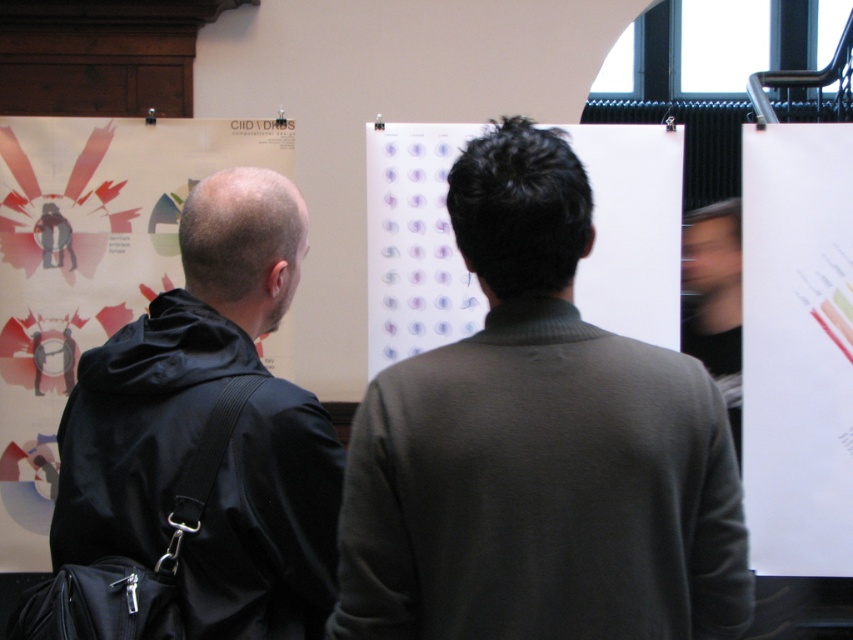
Which is in front, point (325, 566) or point (798, 540)?

Point (325, 566)

Identify the location of black matte jacket at left. The image size is (853, 640). (204, 426).

Is white paper at right thinner than white paper at center?

Yes.

Is white paper at right shorter than white paper at center?

No.

Find the location of a particular element. This screenshot has width=853, height=640. white paper at right is located at coordinates (798, 348).

This screenshot has width=853, height=640. In order to click on white paper at right in this screenshot , I will do `click(798, 348)`.

Is point (485, 529) farther from camera compared to point (260, 234)?

No, (485, 529) is in front of (260, 234).

Measure the distance from dark green sweater at center to black matte jacket at left.

The distance of dark green sweater at center from black matte jacket at left is 14.08 inches.

Where is `dark green sweater at center`? dark green sweater at center is located at coordinates (538, 449).